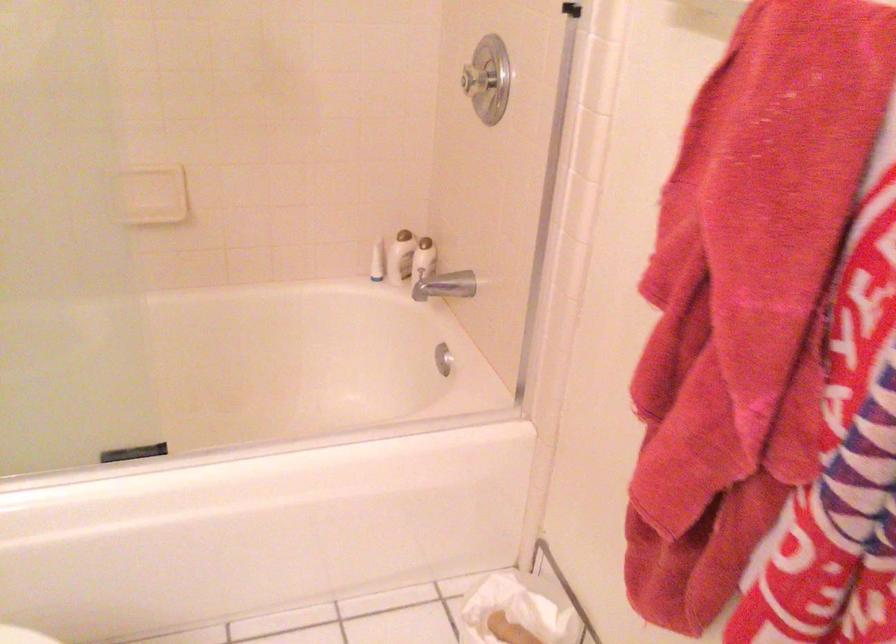
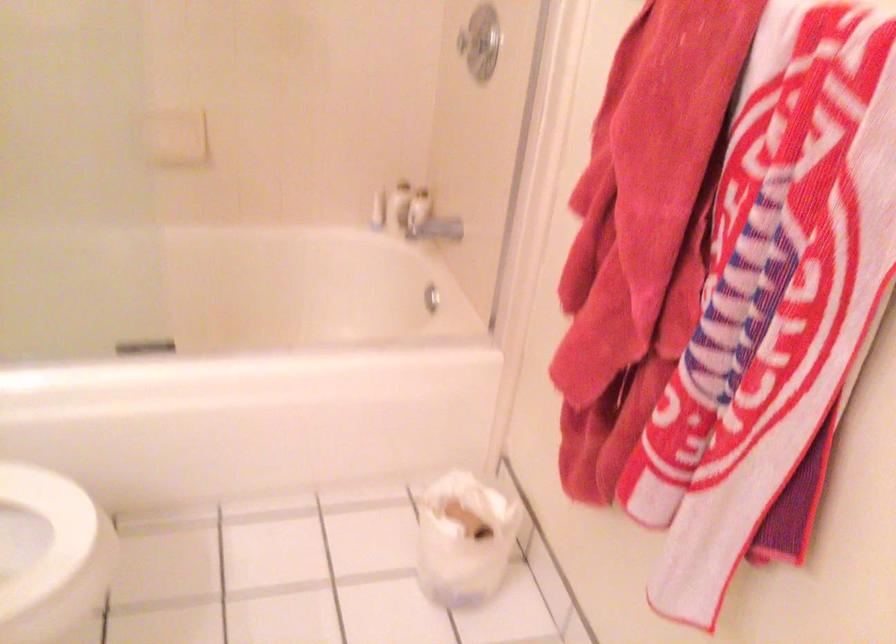
In the second image, find the point that corresponds to the point at 483,84 in the first image.

(478, 42)